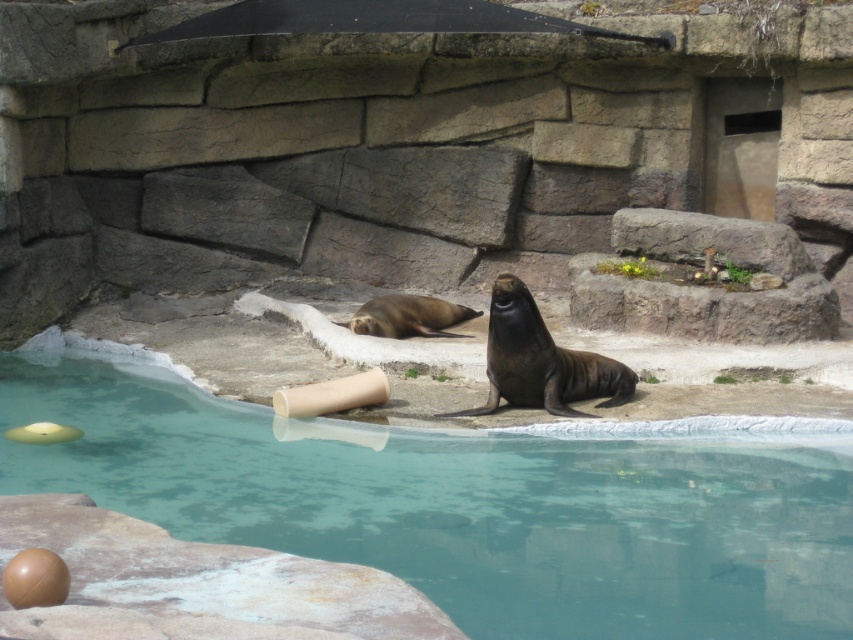
Question: Does transparent glass swimming pool at lower center lie in front of beige cardboard tube at center?

Choices:
 (A) yes
 (B) no

Answer: (A)

Question: Which object appears farthest from the camera in this image?

Choices:
 (A) transparent glass swimming pool at lower center
 (B) beige cardboard tube at center

Answer: (B)

Question: Is transparent glass swimming pool at lower center to the left of beige cardboard tube at center from the viewer's perspective?

Choices:
 (A) no
 (B) yes

Answer: (A)

Question: Among these points, which one is farthest from the camera?

Choices:
 (A) (312, 394)
 (B) (653, 540)

Answer: (A)

Question: Is transparent glass swimming pool at lower center closer to camera compared to beige cardboard tube at center?

Choices:
 (A) no
 (B) yes

Answer: (B)